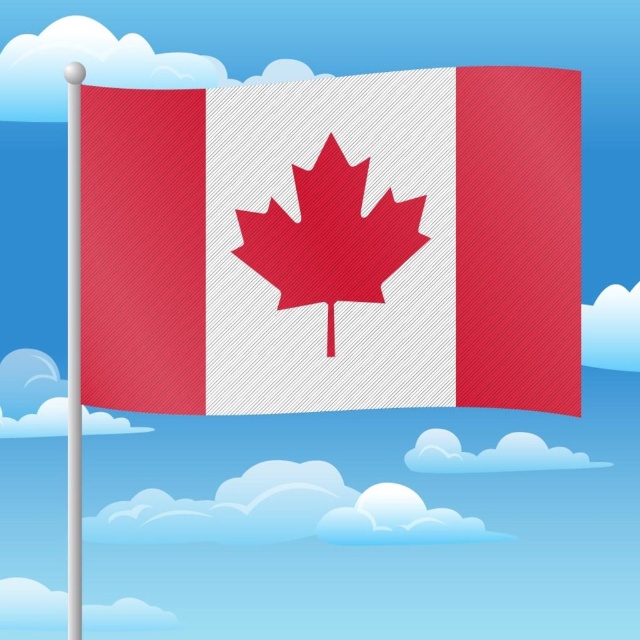
Is textured fabric flag at center above white fluffy cloud at lower left?

Yes, textured fabric flag at center is above white fluffy cloud at lower left.

Is textured fabric flag at center taller than white fluffy cloud at lower left?

In fact, textured fabric flag at center may be shorter than white fluffy cloud at lower left.

Where is `textured fabric flag at center`? The width and height of the screenshot is (640, 640). textured fabric flag at center is located at coordinates (333, 243).

Which is below, silver metallic flag pole at left or white fluffy cloud at lower left?

white fluffy cloud at lower left is below.

Does silver metallic flag pole at left have a larger size compared to white fluffy cloud at lower left?

Incorrect, silver metallic flag pole at left is not larger than white fluffy cloud at lower left.

The width and height of the screenshot is (640, 640). What are the coordinates of `silver metallic flag pole at left` in the screenshot? It's located at (74, 353).

Where is `silver metallic flag pole at left`? silver metallic flag pole at left is located at coordinates (74, 353).

What do you see at coordinates (333, 243) in the screenshot? Image resolution: width=640 pixels, height=640 pixels. I see `textured fabric flag at center` at bounding box center [333, 243].

Which is in front, point (278, 92) or point (330, 236)?

Point (330, 236) is in front.

Identify the location of textured fabric flag at center. (333, 243).